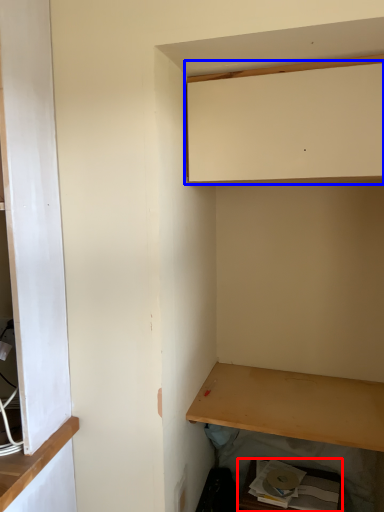
Question: Which object appears closest to the camera in this image, cabinetry (highlighted by a red box) or cabinetry (highlighted by a blue box)?

Choices:
 (A) cabinetry
 (B) cabinetry

Answer: (B)